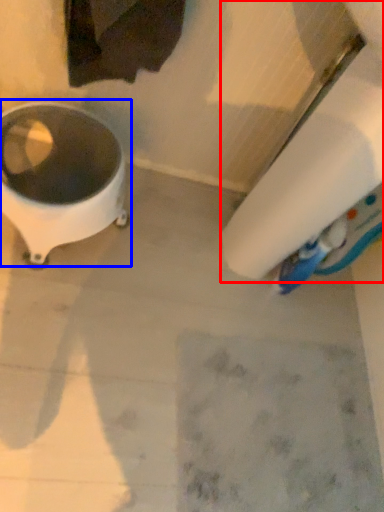
Question: Which point is further to the camera, toilet paper (highlighted by a red box) or waste container (highlighted by a blue box)?

Choices:
 (A) toilet paper
 (B) waste container

Answer: (B)